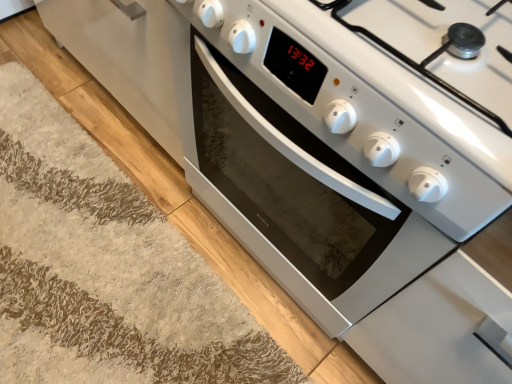
Question: Is white shaggy rug at lower left inside the boundaries of white glossy oven at center, or outside?

Choices:
 (A) outside
 (B) inside

Answer: (A)

Question: In the image, is white shaggy rug at lower left positioned in front of or behind white glossy oven at center?

Choices:
 (A) front
 (B) behind

Answer: (B)

Question: Considering the relative positions of white shaggy rug at lower left and white glossy oven at center in the image provided, is white shaggy rug at lower left to the left or to the right of white glossy oven at center?

Choices:
 (A) right
 (B) left

Answer: (B)

Question: Choose the correct answer: Is white glossy oven at center inside white shaggy rug at lower left or outside it?

Choices:
 (A) outside
 (B) inside

Answer: (A)

Question: Considering the positions of white glossy oven at center and white shaggy rug at lower left in the image, is white glossy oven at center bigger or smaller than white shaggy rug at lower left?

Choices:
 (A) big
 (B) small

Answer: (A)

Question: Considering their positions, is white glossy oven at center located in front of or behind white shaggy rug at lower left?

Choices:
 (A) behind
 (B) front

Answer: (B)

Question: Is white glossy oven at center wider or thinner than white shaggy rug at lower left?

Choices:
 (A) thin
 (B) wide

Answer: (B)